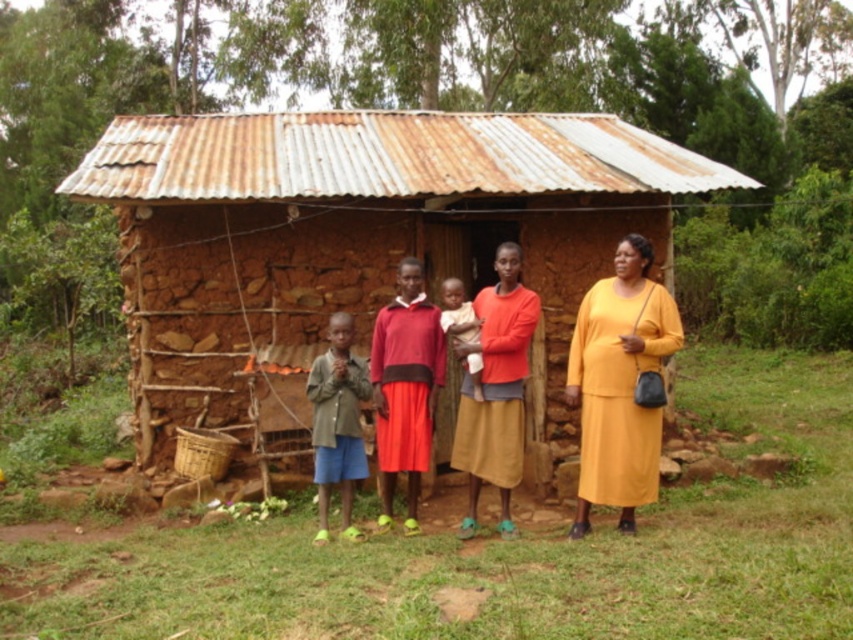
Is rusty corrugated metal hut at center shorter than green fabric shirt at center?

Correct, rusty corrugated metal hut at center is not as tall as green fabric shirt at center.

Identify the location of rusty corrugated metal hut at center. (357, 240).

Find the location of a particular element. The height and width of the screenshot is (640, 853). rusty corrugated metal hut at center is located at coordinates (357, 240).

Is the position of rusty corrugated metal hut at center less distant than that of matte orange dress at center?

No, it is behind matte orange dress at center.

Can you confirm if rusty corrugated metal hut at center is wider than matte orange dress at center?

Yes.

Is point (267, 451) farther from viewer compared to point (505, 403)?

That is True.

What are the coordinates of `rusty corrugated metal hut at center` in the screenshot? It's located at (357, 240).

Does point (635, 484) come in front of point (463, 308)?

Yes, point (635, 484) is closer to viewer.

Is matte orange dress at center thinner than light brown skin at center?

No.

Who is more forward, (654, 360) or (474, 320)?

Point (654, 360) is more forward.

What are the coordinates of `matte orange dress at center` in the screenshot? It's located at (619, 384).